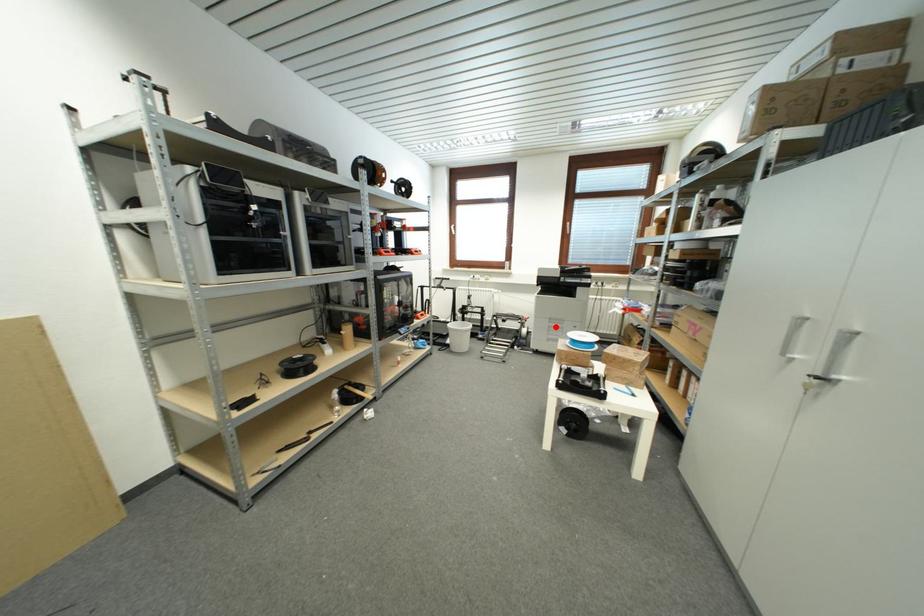
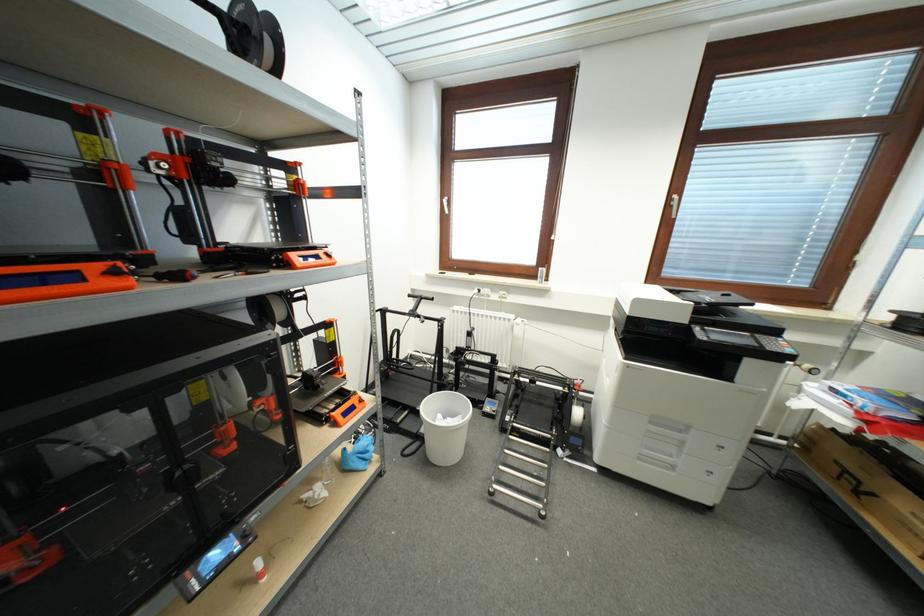
Find the pixel in the second image that matches the highlighted location in the first image.

(658, 431)